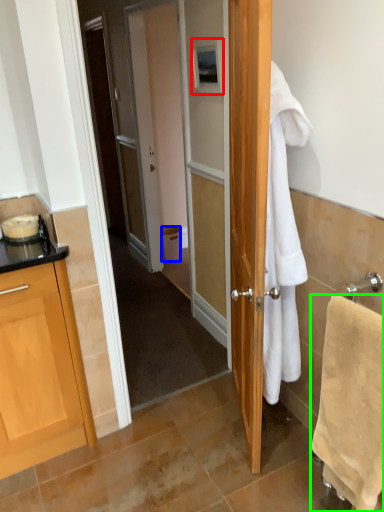
Question: Considering the real-world distances, which object is farthest from picture frame (highlighted by a red box)? trash bin/can (highlighted by a blue box) or towel/napkin (highlighted by a green box)?

Choices:
 (A) trash bin/can
 (B) towel/napkin

Answer: (A)